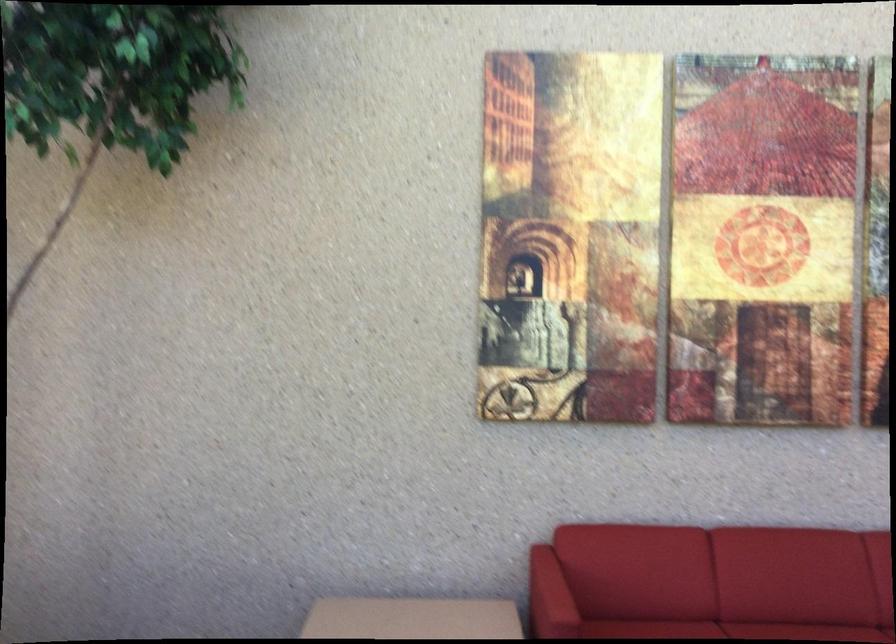
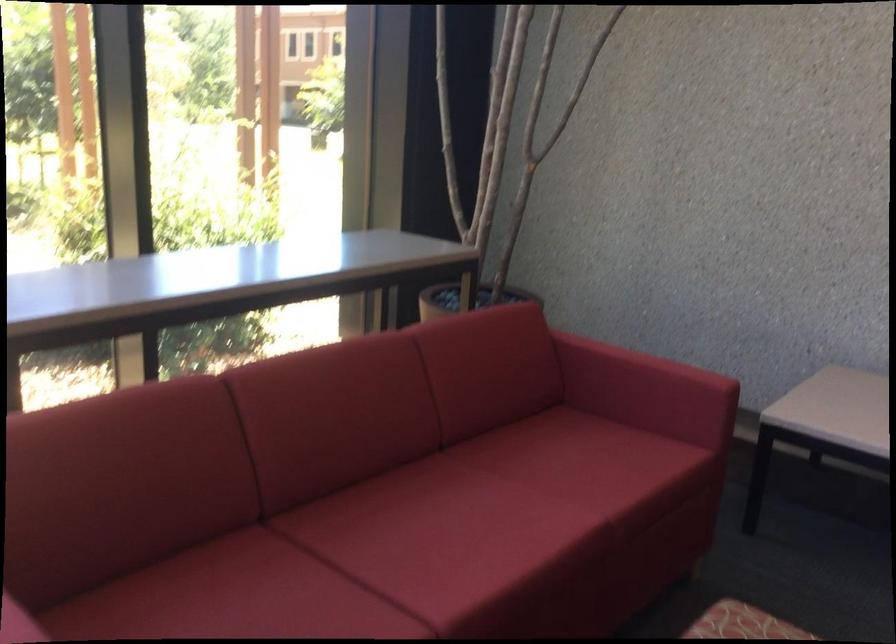
In the scene shown: The first image is from the beginning of the video and the second image is from the end. How did the camera likely rotate when shooting the video?

The camera's rotation is toward left-down.